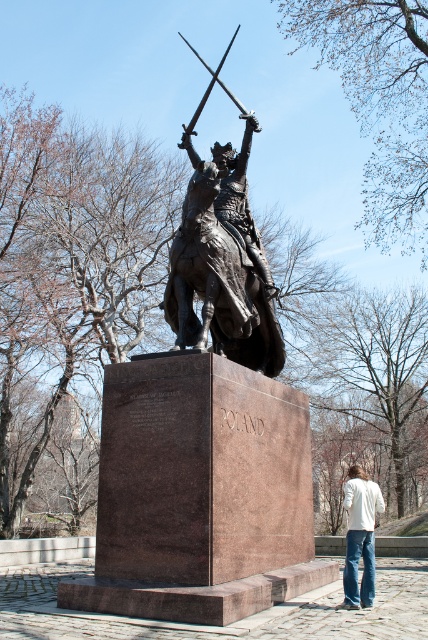
You are a photographer standing in front of the bronze statue of a mounted knight. You want to take a photo that includes both the point at coordinate (256, 124) and the point at coordinate (354, 540). Which point will appear closer to the camera in the photo?

Point (256, 124) is further to the camera than point (354, 540), so the point at (256, 124) will appear closer to the camera in the photo.

You are a photographer trying to capture both the bronze statue at center and the white cotton shirt at lower right in a single frame. Since the statue is larger, where should you position yourself relative to them to ensure both are visible in the photo?

To include both the bronze statue at center and the white cotton shirt at lower right in the photo, you should position yourself farther away from them. This will allow the statue, which is larger, to fit within the frame while still capturing the smaller white cotton shirt at lower right.

You are an art conservator examining the bronze statue at center and the white cotton shirt at lower right. Which object is closer to you?

The bronze statue at center is closer to you because the white cotton shirt at lower right is behind it.